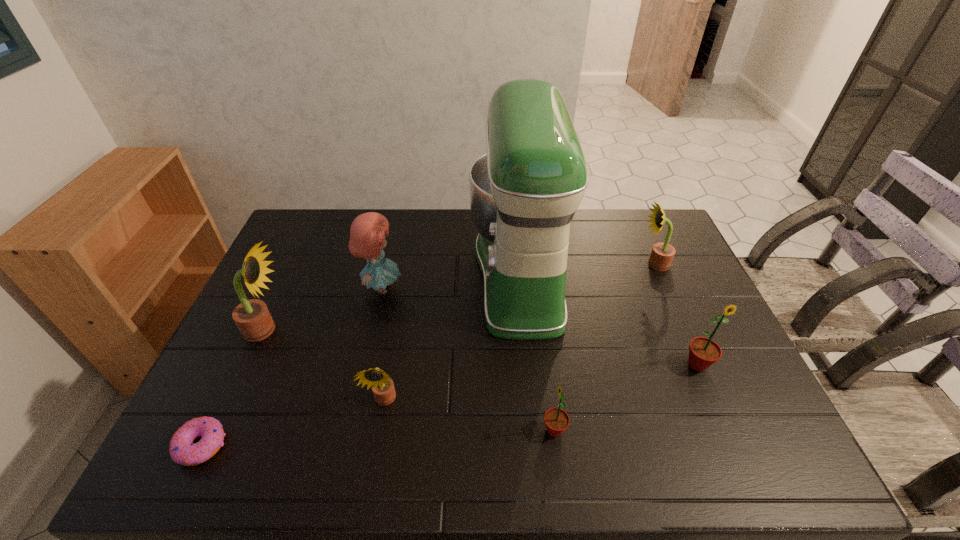
Locate an element on the screen. The width and height of the screenshot is (960, 540). sunflower that is the third closest to the nearest yellow sunflower is located at coordinates (703, 352).

Identify which sunflower is the fourth nearest to the smallest yellow sunflower. Please provide its 2D coordinates. Your answer should be formatted as a tuple, i.e. [(x, y)], where the tuple contains the x and y coordinates of a point satisfying the conditions above.

[(662, 254)]

This screenshot has height=540, width=960. What are the coordinates of `yellow sunflower that is the closest one to the second farthest sunflower` in the screenshot? It's located at (383, 389).

Locate which yellow sunflower ranks in proximity to the second farthest sunflower. Please provide its 2D coordinates. Your answer should be formatted as a tuple, i.e. [(x, y)], where the tuple contains the x and y coordinates of a point satisfying the conditions above.

[(383, 389)]

I want to click on free location that satisfies the following two spatial constraints: 1. on the face of the farthest sunflower; 2. on the face of the nearest yellow sunflower, so click(x=713, y=401).

The height and width of the screenshot is (540, 960). What are the coordinates of `vacant space that satisfies the following two spatial constraints: 1. on the face of the rightmost yellow sunflower; 2. on the face of the fifth farthest object` in the screenshot? It's located at (698, 364).

What are the coordinates of `vacant space that satisfies the following two spatial constraints: 1. on the front-facing side of the doll; 2. on the front side of the pink doughnut` in the screenshot? It's located at (346, 446).

I want to click on free location that satisfies the following two spatial constraints: 1. on the face of the left green sunflower; 2. on the front side of the shortest object, so click(x=556, y=446).